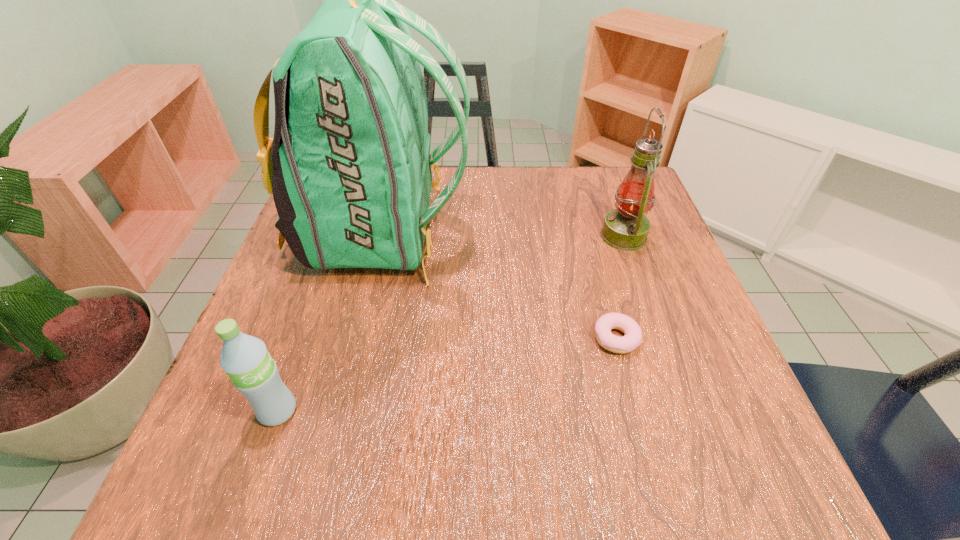
Locate an element on the screen. Image resolution: width=960 pixels, height=540 pixels. free space at the right edge of the desktop is located at coordinates (640, 299).

I want to click on vacant region at the far right corner of the desktop, so click(610, 177).

Where is `vacant area between the doughnut and the third shortest object`? Image resolution: width=960 pixels, height=540 pixels. vacant area between the doughnut and the third shortest object is located at coordinates (619, 287).

Where is `unoccupied area between the doughnut and the nearest object`? This screenshot has height=540, width=960. unoccupied area between the doughnut and the nearest object is located at coordinates (446, 375).

Locate an element on the screen. The height and width of the screenshot is (540, 960). free space between the doughnut and the backpack is located at coordinates (499, 286).

Find the location of a particular element. This screenshot has height=540, width=960. vacant space that's between the doughnut and the backpack is located at coordinates (499, 286).

Identify the location of vacant space in between the third tallest object and the backpack. (330, 322).

Locate an element on the screen. The image size is (960, 540). vacant space that's between the second nearest object and the tallest object is located at coordinates (499, 286).

At what (x,y) coordinates should I click in order to perform the action: click on free space that is in between the water bottle and the oil lamp. Please return your answer as a coordinate pair (x, y). The width and height of the screenshot is (960, 540). Looking at the image, I should click on (450, 323).

In order to click on vacant space that's between the oil lamp and the nearest object in this screenshot , I will do `click(450, 323)`.